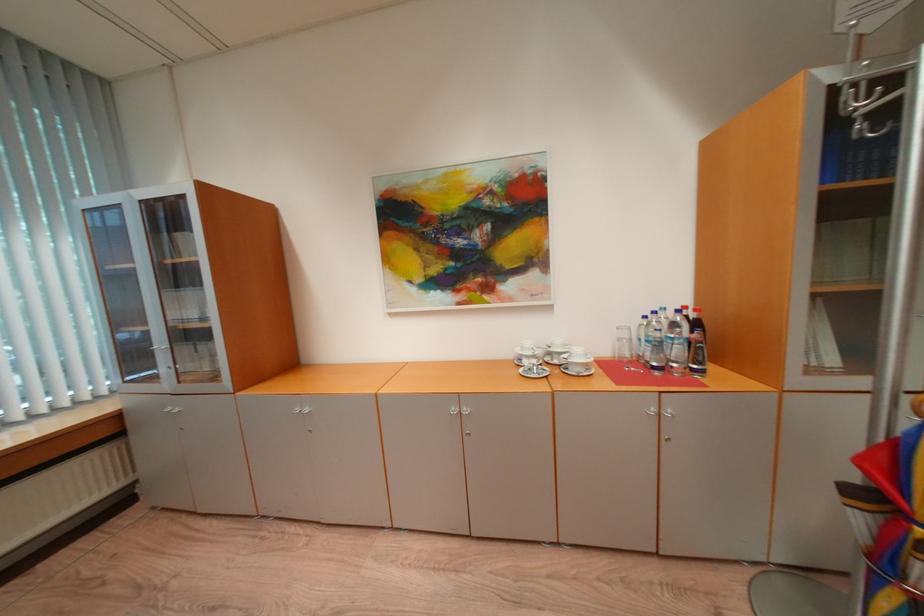
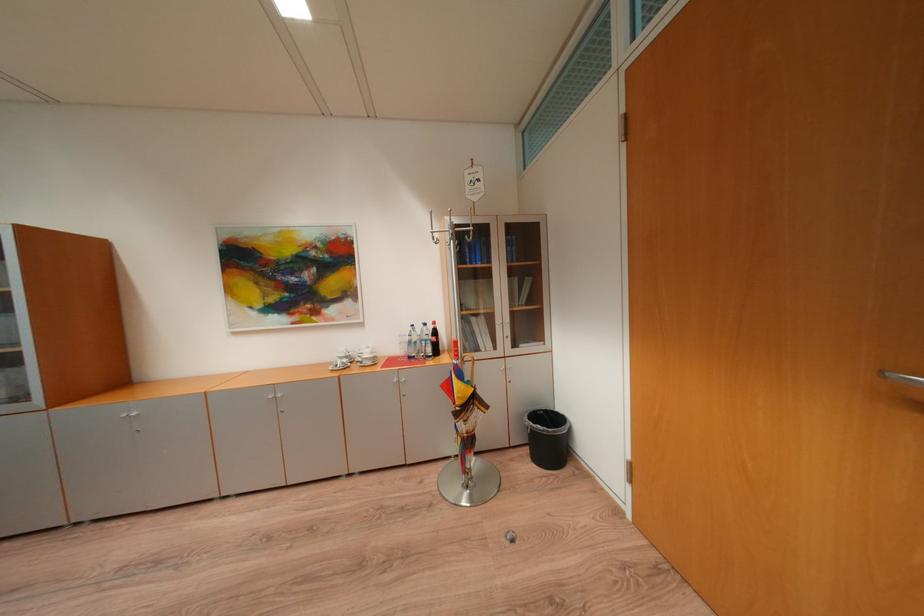
Locate, in the second image, the point that corresponds to [463,411] in the first image.

(280, 398)